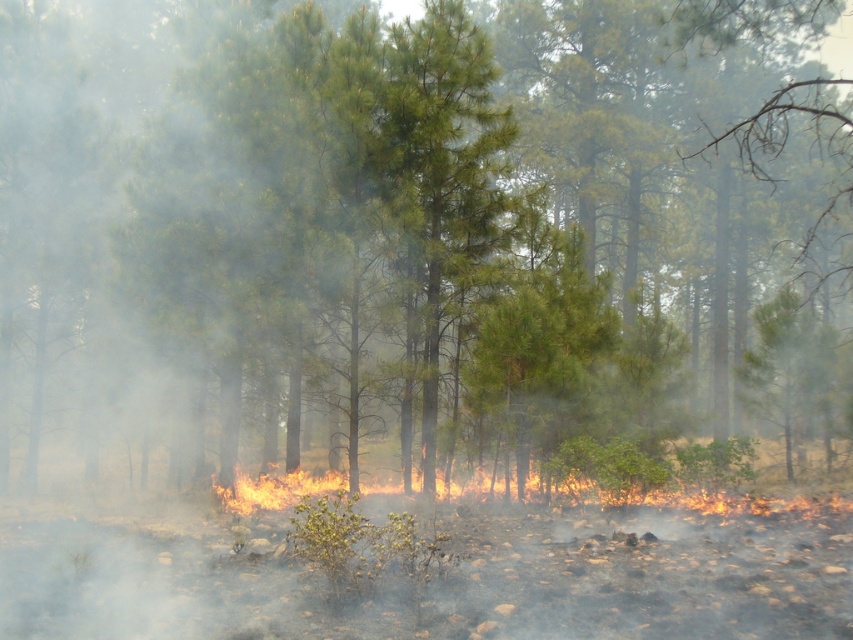
Does green textured pine tree at center have a lesser height compared to flaming yellow-orange fire at center?

No, green textured pine tree at center is not shorter than flaming yellow-orange fire at center.

Can you confirm if green textured pine tree at center is positioned to the right of flaming yellow-orange fire at center?

No, green textured pine tree at center is not to the right of flaming yellow-orange fire at center.

Which is behind, point (381, 108) or point (828, 486)?

Point (381, 108)

This screenshot has width=853, height=640. I want to click on green textured pine tree at center, so click(x=439, y=177).